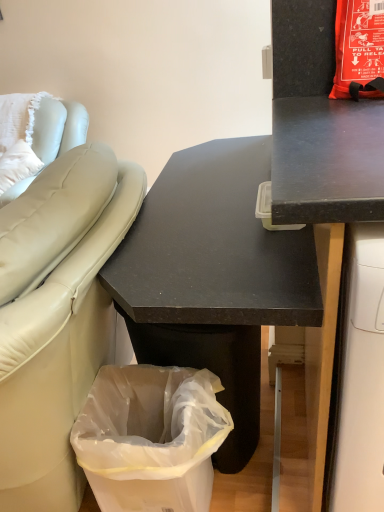
Question: Is transparent plastic bag at lower left smaller than black matte desk at upper right, the second desk when ordered from left to right?

Choices:
 (A) yes
 (B) no

Answer: (A)

Question: Does transparent plastic bag at lower left come behind black matte desk at upper right, the second desk when ordered from left to right?

Choices:
 (A) no
 (B) yes

Answer: (B)

Question: From a real-world perspective, is transparent plastic bag at lower left on top of black matte desk at upper right, the first desk positioned from the right?

Choices:
 (A) yes
 (B) no

Answer: (B)

Question: Is transparent plastic bag at lower left outside of black matte desk at upper right, the second desk when ordered from left to right?

Choices:
 (A) yes
 (B) no

Answer: (A)

Question: Is transparent plastic bag at lower left at the right side of black matte desk at upper right, the first desk positioned from the right?

Choices:
 (A) no
 (B) yes

Answer: (A)

Question: From their relative heights in the image, would you say white leather couch at left is taller or shorter than transparent plastic bag at lower left?

Choices:
 (A) tall
 (B) short

Answer: (B)

Question: From a real-world perspective, relative to transparent plastic bag at lower left, is white leather couch at left vertically above or below?

Choices:
 (A) below
 (B) above

Answer: (B)

Question: Looking at the image, does white leather couch at left seem bigger or smaller compared to transparent plastic bag at lower left?

Choices:
 (A) small
 (B) big

Answer: (B)

Question: Considering the positions of point (72, 134) and point (140, 474), is point (72, 134) closer or farther from the camera than point (140, 474)?

Choices:
 (A) closer
 (B) farther

Answer: (B)

Question: In terms of size, does transparent plastic bag at lower left appear bigger or smaller than black matte desk at center, which appears as the first desk when viewed from the left?

Choices:
 (A) big
 (B) small

Answer: (B)

Question: Is transparent plastic bag at lower left taller or shorter than black matte desk at center, which appears as the first desk when viewed from the left?

Choices:
 (A) short
 (B) tall

Answer: (A)

Question: From a real-world perspective, is transparent plastic bag at lower left physically located above or below black matte desk at center, which appears as the first desk when viewed from the left?

Choices:
 (A) below
 (B) above

Answer: (A)

Question: Relative to black matte desk at center, positioned as the second desk in right-to-left order, is transparent plastic bag at lower left in front or behind?

Choices:
 (A) behind
 (B) front

Answer: (A)

Question: From a real-world perspective, relative to black matte desk at upper right, the second desk when ordered from left to right, is black matte desk at center, positioned as the second desk in right-to-left order, vertically above or below?

Choices:
 (A) below
 (B) above

Answer: (A)

Question: Visually, is black matte desk at center, which appears as the first desk when viewed from the left, positioned to the left or to the right of black matte desk at upper right, the second desk when ordered from left to right?

Choices:
 (A) right
 (B) left

Answer: (B)